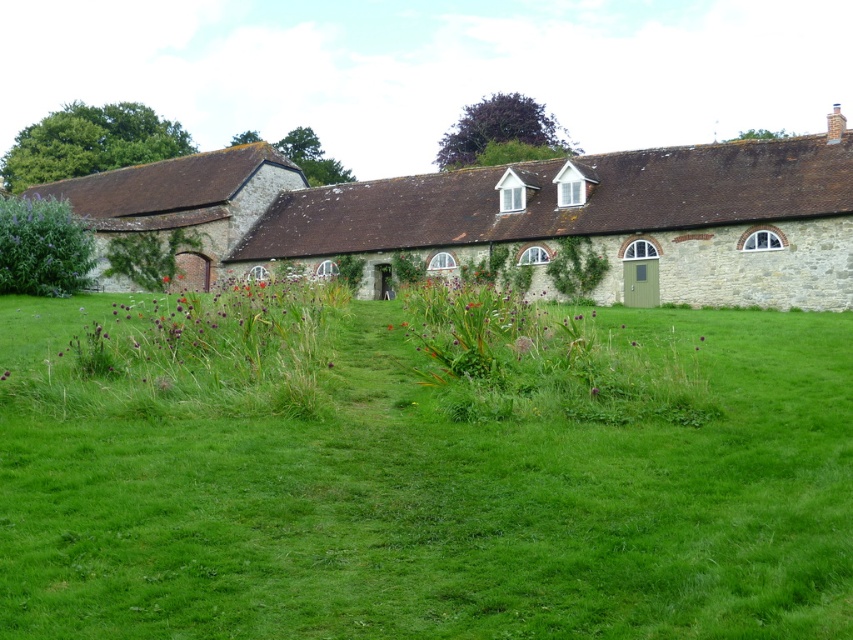
Between stone cottage at center and purple matte flower at center, which one is positioned higher?

stone cottage at center is higher up.

Which is more to the left, stone cottage at center or purple matte flower at center?

Positioned to the left is stone cottage at center.

Is point (451, 225) positioned before point (703, 339)?

No, it is not.

Where is `stone cottage at center`? Image resolution: width=853 pixels, height=640 pixels. stone cottage at center is located at coordinates (599, 221).

Who is positioned more to the left, green grass at center or brown stone cottage at left?

brown stone cottage at left

Is point (351, 616) closer to viewer compared to point (119, 182)?

Yes, it is in front of point (119, 182).

Which is behind, point (434, 600) or point (189, 252)?

Positioned behind is point (189, 252).

This screenshot has height=640, width=853. I want to click on green grass at center, so click(x=450, y=508).

Between brown stone cottage at left and purple matte flower at center, which one appears on the left side from the viewer's perspective?

Positioned to the left is brown stone cottage at left.

Can you confirm if brown stone cottage at left is shorter than purple matte flower at center?

Incorrect, brown stone cottage at left's height does not fall short of purple matte flower at center's.

What do you see at coordinates (181, 200) in the screenshot?
I see `brown stone cottage at left` at bounding box center [181, 200].

I want to click on brown stone cottage at left, so click(x=181, y=200).